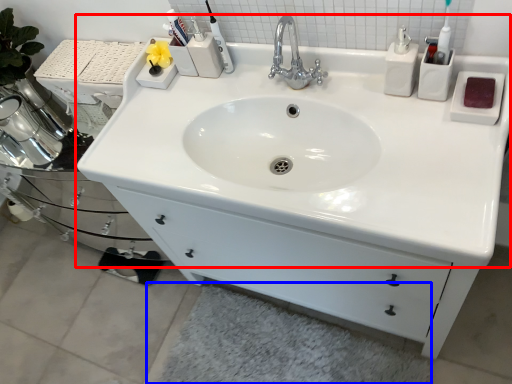
Question: Which point is closer to the camera, sink (highlighted by a red box) or bath mat (highlighted by a blue box)?

Choices:
 (A) sink
 (B) bath mat

Answer: (A)